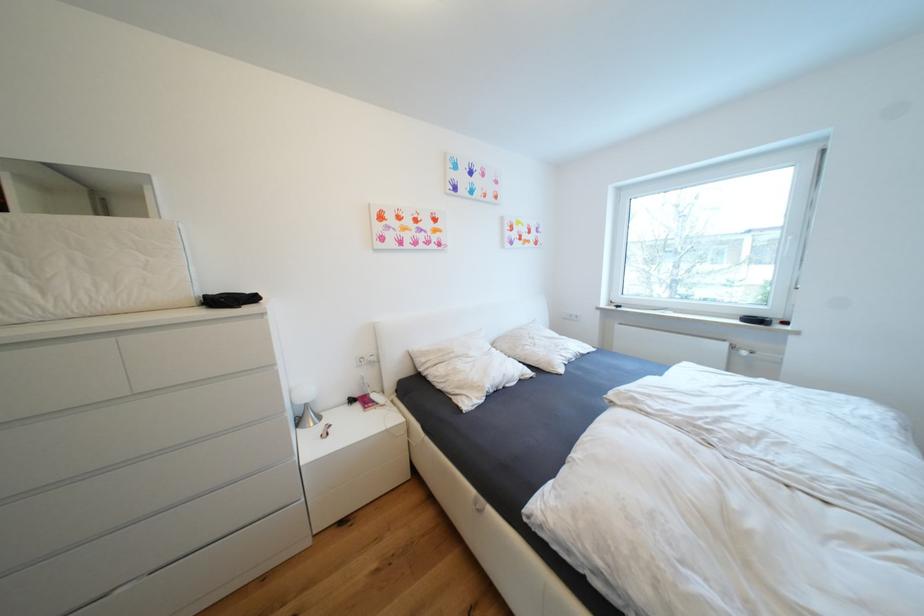
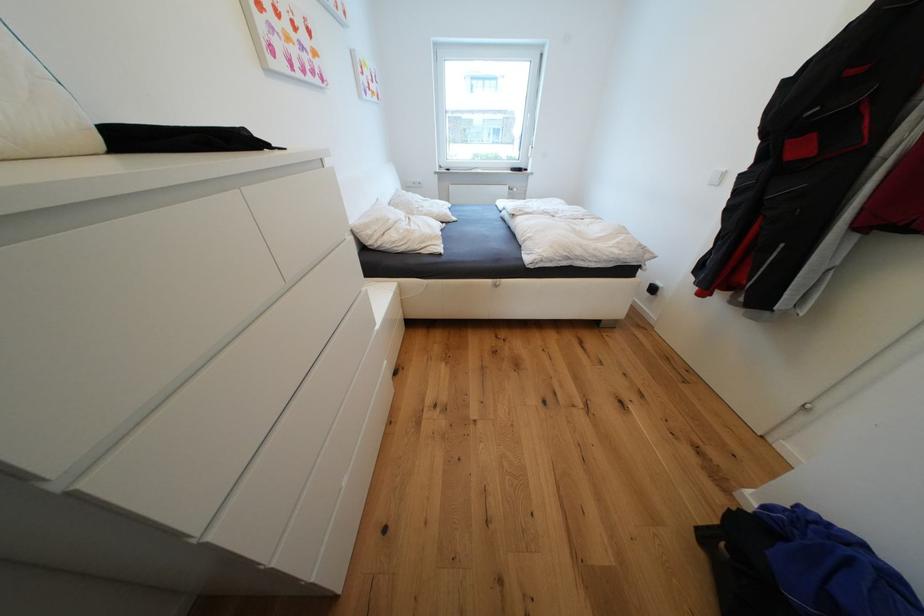
Locate, in the second image, the point that corresponds to the point at 480,493 in the first image.

(496, 282)